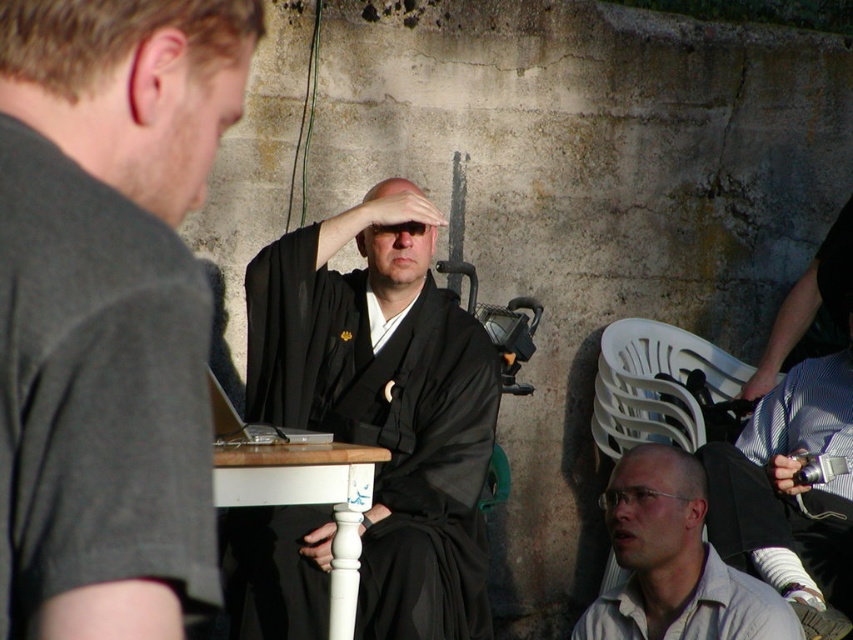
You are a photographer trying to capture a candid shot of the light beige cotton shirt at lower right and the blue striped shirt at lower right. Since you can only focus on one person at a time, which one should you choose to ensure the other remains in the background?

The light beige cotton shirt at lower right is closer to the viewer than the blue striped shirt at lower right, so you should focus on the light beige cotton shirt at lower right to have the blue striped shirt at lower right in the background.

You are a photographer trying to capture a group photo of the people at the event. You notice the dark gray shirt at left and the black striped shirt at right. Based on their positions, which person should you ask to move up so that both are visible in the frame?

The dark gray shirt at left is below the black striped shirt at right, so you should ask the dark gray shirt at left to move up to ensure both are visible in the frame.

You are standing at the center of the image and want to greet the dark gray shirt at left. In which direction should you move to approach them?

You should move to the left because the dark gray shirt at left is located to the left of the center position.